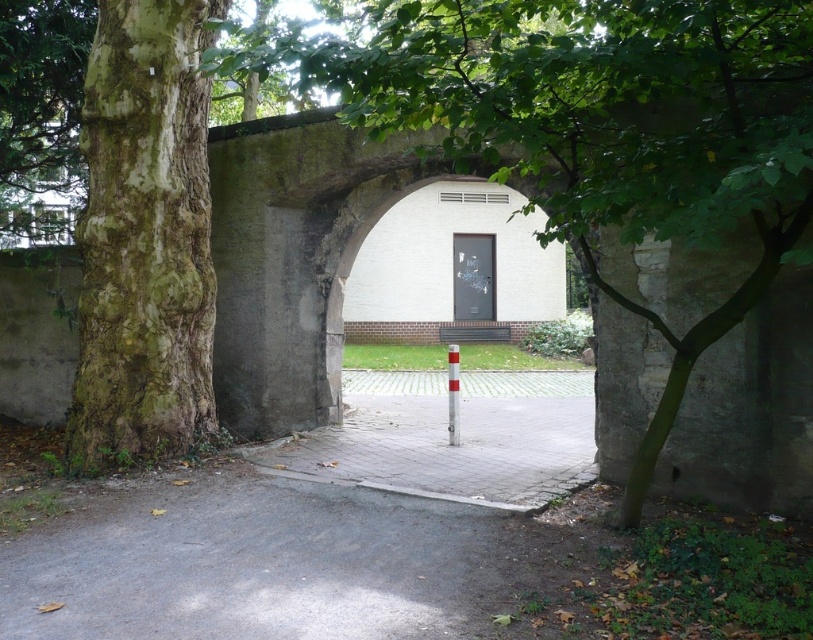
Between green mossy bark tree at left and paved stone alley at center, which one has less height?

With less height is paved stone alley at center.

Which is more to the right, green mossy bark tree at left or paved stone alley at center?

paved stone alley at center is more to the right.

Image resolution: width=813 pixels, height=640 pixels. I want to click on green mossy bark tree at left, so click(x=144, y=236).

Where is `green mossy bark tree at left`? The image size is (813, 640). green mossy bark tree at left is located at coordinates [x=144, y=236].

Does green leafy tree at center have a larger size compared to green mossy bark tree at left?

Indeed, green leafy tree at center has a larger size compared to green mossy bark tree at left.

Between green leafy tree at center and green mossy bark tree at left, which one is positioned lower?

green leafy tree at center is lower down.

In the scene shown: Who is more forward, (655,84) or (140,253)?

Positioned in front is point (655,84).

The image size is (813, 640). What are the coordinates of `green leafy tree at center` in the screenshot? It's located at (598, 129).

Which is behind, point (446, 451) or point (457, 440)?

Positioned behind is point (457, 440).

Does paved stone alley at center appear under white glossy pole at center?

Yes, paved stone alley at center is below white glossy pole at center.

Identify the location of paved stone alley at center. Image resolution: width=813 pixels, height=640 pixels. (446, 449).